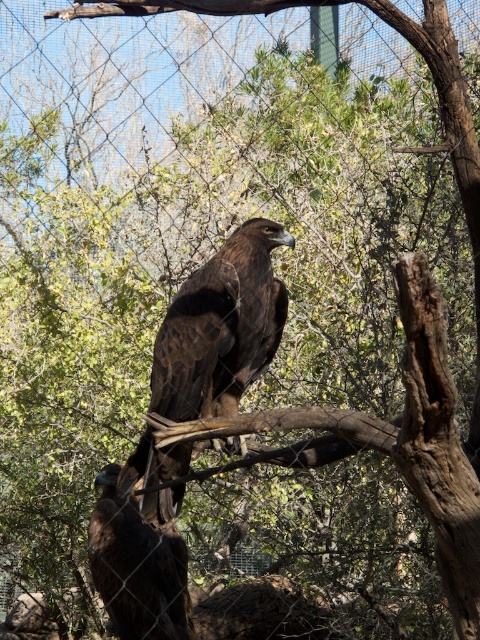
You are a zookeeper observing the brown feathered eagle at center and the dark brown feathers at center in the enclosure. Which object is closer to you?

The brown feathered eagle at center is closer to the viewer than the dark brown feathers at center.

You are standing at the point marked as point (175, 420) in the zoo enclosure. You want to take a photo of the golden eagle perched on the branch. If your camera is 4.20 meters away from you, will you be able to capture the entire golden eagle in the photo without moving?

The distance between you at point (175, 420) and the camera is 4.20 meters. Since the camera is positioned 4.20 meters away from your location, you can adjust your framing to ensure the entire golden eagle is captured in the photo without needing to move.

You are a zookeeper observing the enclosure. You notice the brown feathered eagle at center and the dark brown feathers at center. Which object is wider?

The brown feathered eagle at center is wider than the dark brown feathers at center.